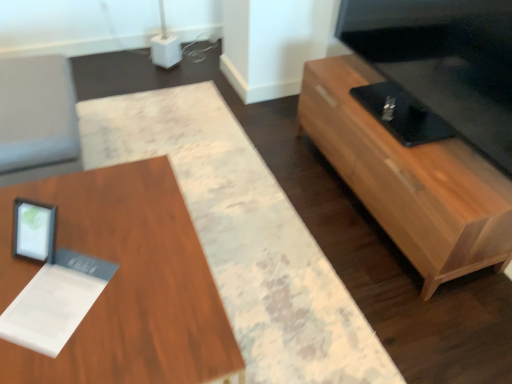
Question: Is wooden tv stand at right, which is the 2th table from left to right, bigger or smaller than wooden table at center, which appears as the second table when viewed from the right?

Choices:
 (A) big
 (B) small

Answer: (B)

Question: Does point click(309, 92) appear closer or farther from the camera than point click(75, 190)?

Choices:
 (A) farther
 (B) closer

Answer: (A)

Question: Based on their positions, is wooden tv stand at right, which ranks as the first table in right-to-left order, located to the left or right of wooden table at center, which is the 1th table in left-to-right order?

Choices:
 (A) left
 (B) right

Answer: (B)

Question: Relative to wooden tv stand at right, which is the 2th table from left to right, is wooden table at center, which is the 1th table in left-to-right order, in front or behind?

Choices:
 (A) front
 (B) behind

Answer: (A)

Question: In terms of size, does wooden table at center, which appears as the second table when viewed from the right, appear bigger or smaller than wooden tv stand at right, which ranks as the first table in right-to-left order?

Choices:
 (A) small
 (B) big

Answer: (B)

Question: From a real-world perspective, is wooden table at center, which appears as the second table when viewed from the right, above or below wooden tv stand at right, which ranks as the first table in right-to-left order?

Choices:
 (A) above
 (B) below

Answer: (B)

Question: From the image's perspective, relative to wooden tv stand at right, which ranks as the first table in right-to-left order, is wooden table at center, which is the 1th table in left-to-right order, above or below?

Choices:
 (A) below
 (B) above

Answer: (A)